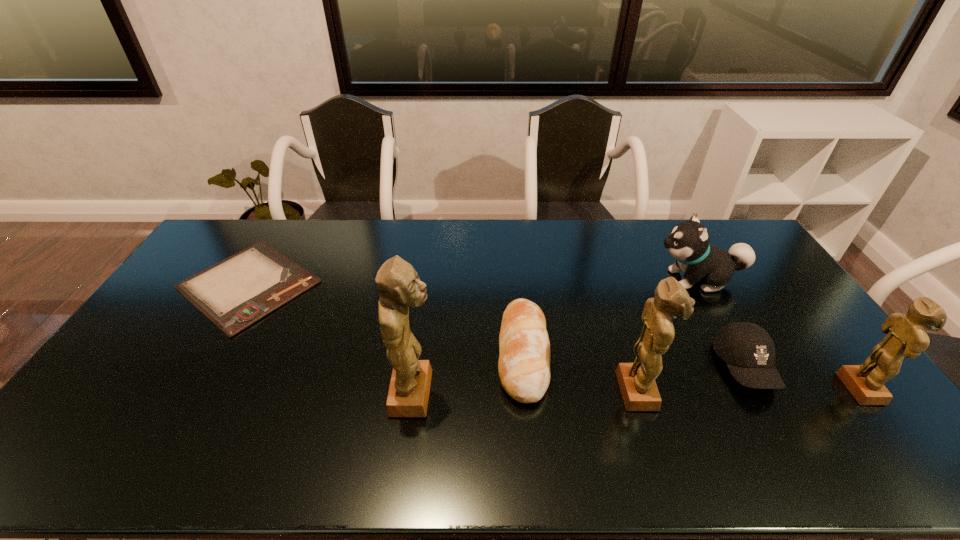
The width and height of the screenshot is (960, 540). Find the location of `vacant area that lies between the bread and the fourth object from right to left`. vacant area that lies between the bread and the fourth object from right to left is located at coordinates (581, 372).

You are a GUI agent. You are given a task and a screenshot of the screen. Output one action in this format:
    pyautogui.click(x=<x>, y=<y>)
    Task: Click on the free point between the baseball cap and the fourth tallest object
    The width and height of the screenshot is (960, 540).
    Given the screenshot: What is the action you would take?
    pyautogui.click(x=721, y=323)

Where is `vacant point located between the puppy and the fifth object from right to left`? Image resolution: width=960 pixels, height=540 pixels. vacant point located between the puppy and the fifth object from right to left is located at coordinates (610, 316).

Where is `free space between the fifth object from right to left and the baseball cap`? free space between the fifth object from right to left and the baseball cap is located at coordinates (634, 360).

I want to click on vacant area between the second figurine from left to right and the baseball cap, so click(x=692, y=379).

Where is `vacant space in between the leftmost figurine and the fourth shortest object`? vacant space in between the leftmost figurine and the fourth shortest object is located at coordinates (556, 336).

What are the coordinates of `free space between the bread and the second object from left to right` in the screenshot? It's located at (468, 373).

This screenshot has height=540, width=960. I want to click on free space between the baseball cap and the sixth object from right to left, so click(580, 380).

Where is `unoccupied position between the bread and the baseball cap`? This screenshot has width=960, height=540. unoccupied position between the bread and the baseball cap is located at coordinates (634, 360).

Identify which object is located as the fifth nearest to the bread. Please provide its 2D coordinates. Your answer should be formatted as a tuple, i.e. [(x, y)], where the tuple contains the x and y coordinates of a point satisfying the conditions above.

[(236, 292)]